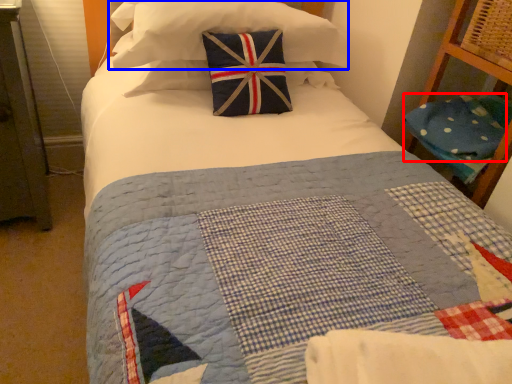
Question: Which object appears closest to the camera in this image, pillow (highlighted by a red box) or pillow (highlighted by a blue box)?

Choices:
 (A) pillow
 (B) pillow

Answer: (B)